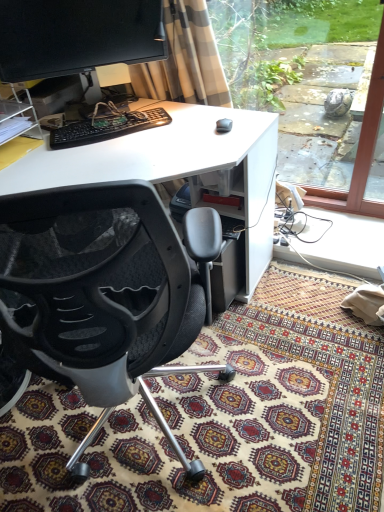
Question: Can you confirm if black mesh chair at center is taller than matte black monitor at upper left?

Choices:
 (A) no
 (B) yes

Answer: (B)

Question: Does black mesh chair at center contain matte black monitor at upper left?

Choices:
 (A) yes
 (B) no

Answer: (B)

Question: Is black mesh chair at center positioned beyond the bounds of matte black monitor at upper left?

Choices:
 (A) yes
 (B) no

Answer: (A)

Question: Considering the relative positions of black mesh chair at center and matte black monitor at upper left in the image provided, is black mesh chair at center to the right of matte black monitor at upper left from the viewer's perspective?

Choices:
 (A) yes
 (B) no

Answer: (A)

Question: Can you confirm if black mesh chair at center is smaller than matte black monitor at upper left?

Choices:
 (A) yes
 (B) no

Answer: (B)

Question: Looking at the image, does satin beige curtain at upper center seem bigger or smaller compared to transparent glass window at right?

Choices:
 (A) small
 (B) big

Answer: (A)

Question: From a real-world perspective, relative to transparent glass window at right, is satin beige curtain at upper center vertically above or below?

Choices:
 (A) above
 (B) below

Answer: (A)

Question: Is point (132, 87) closer or farther from the camera than point (228, 84)?

Choices:
 (A) farther
 (B) closer

Answer: (B)

Question: From the image's perspective, is satin beige curtain at upper center located above or below transparent glass window at right?

Choices:
 (A) below
 (B) above

Answer: (A)

Question: Is point (230, 428) closer or farther from the camera than point (364, 6)?

Choices:
 (A) farther
 (B) closer

Answer: (B)

Question: In the image, is patterned carpet at lower center positioned in front of or behind transparent glass window at right?

Choices:
 (A) front
 (B) behind

Answer: (A)

Question: Do you think patterned carpet at lower center is within transparent glass window at right, or outside of it?

Choices:
 (A) outside
 (B) inside

Answer: (A)

Question: From their relative heights in the image, would you say patterned carpet at lower center is taller or shorter than transparent glass window at right?

Choices:
 (A) tall
 (B) short

Answer: (B)

Question: Is patterned carpet at lower center spatially inside black plastic keyboard at center, or outside of it?

Choices:
 (A) outside
 (B) inside

Answer: (A)

Question: Based on their sizes in the image, would you say patterned carpet at lower center is bigger or smaller than black plastic keyboard at center?

Choices:
 (A) small
 (B) big

Answer: (B)